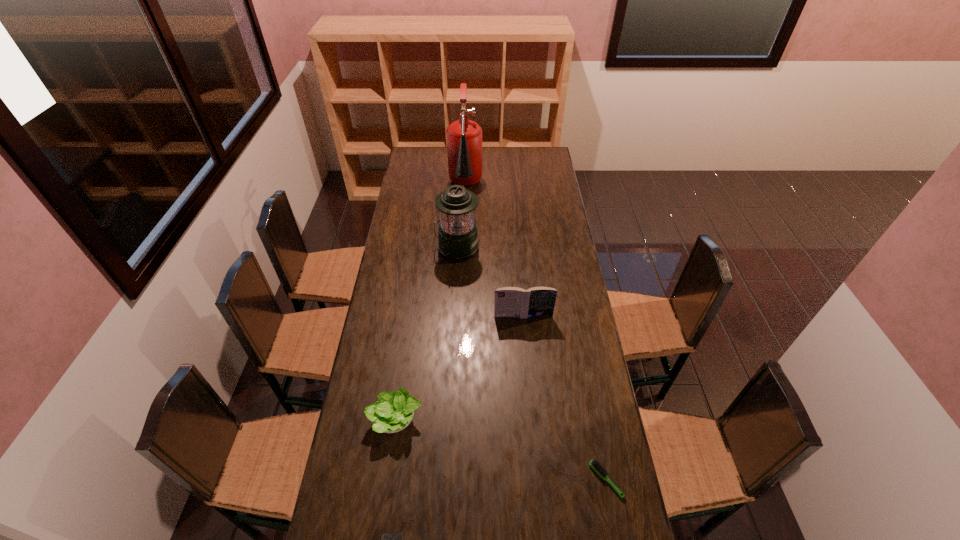
This screenshot has height=540, width=960. I want to click on free space at the right edge of the desktop, so click(538, 242).

This screenshot has height=540, width=960. I want to click on free area in between the second tallest object and the lettuce, so click(426, 334).

Where is `vacant area between the lantern and the fourth nearest object`? vacant area between the lantern and the fourth nearest object is located at coordinates (490, 282).

The height and width of the screenshot is (540, 960). Identify the location of empty space that is in between the third shortest object and the second shortest object. (501, 449).

Identify the location of vacant area that lies between the hairbrush and the farthest object. The width and height of the screenshot is (960, 540). (536, 334).

This screenshot has width=960, height=540. I want to click on free space between the fifth tallest object and the tallest object, so click(536, 334).

Image resolution: width=960 pixels, height=540 pixels. In order to click on free space between the lettuce and the second object from right to left in this screenshot , I will do `click(460, 368)`.

Image resolution: width=960 pixels, height=540 pixels. Find the location of `free space between the hairbrush and the lettuce`. free space between the hairbrush and the lettuce is located at coordinates (501, 449).

At what (x,y) coordinates should I click in order to perform the action: click on object identified as the fourth closest to the remote control. Please return your answer as a coordinate pair (x, y). The height and width of the screenshot is (540, 960). Looking at the image, I should click on (457, 237).

I want to click on the fourth closest object to the shortest object, so click(457, 237).